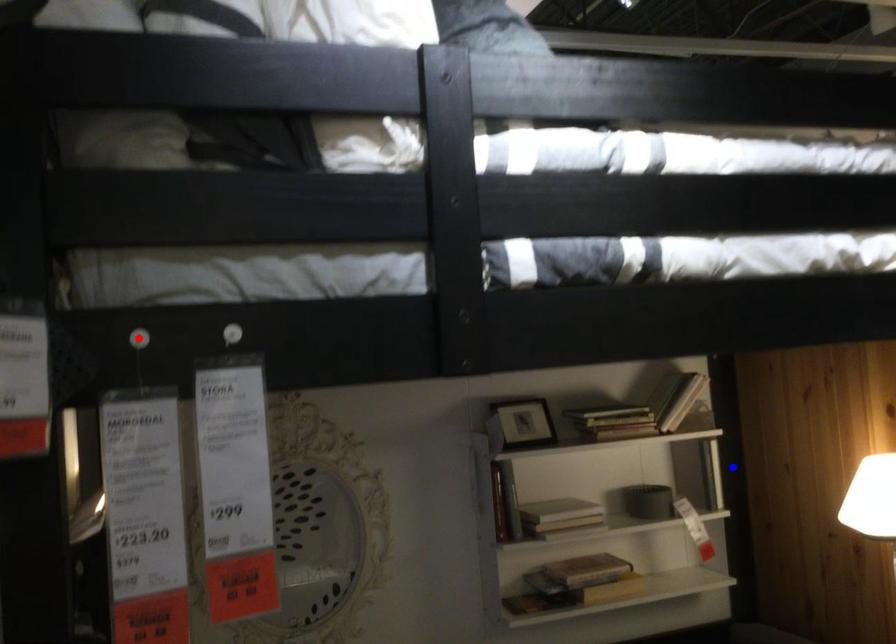
Question: In the image, two points are highlighted. Which point is nearer to the camera? Reply with the corresponding letter.

Choices:
 (A) blue point
 (B) red point

Answer: (B)